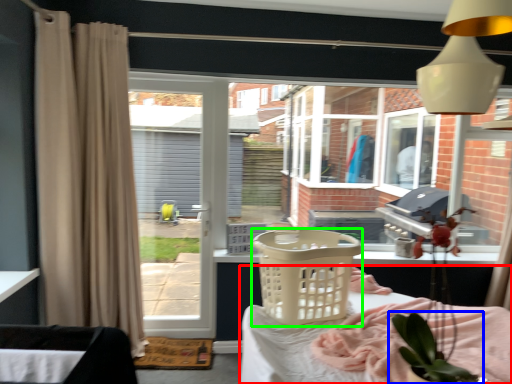
Question: Estimate the real-world distances between objects in this image. Which object is farther from furniture (highlighted by a red box), houseplant (highlighted by a blue box) or basket (highlighted by a green box)?

Choices:
 (A) houseplant
 (B) basket

Answer: (A)